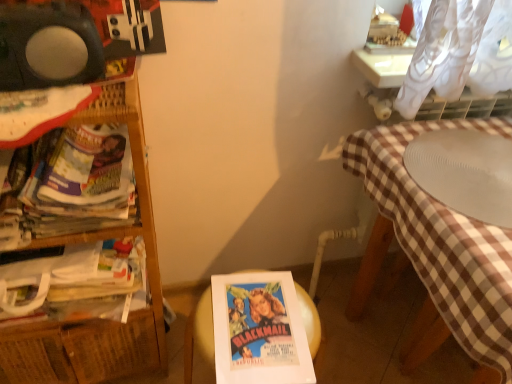
This screenshot has height=384, width=512. I want to click on free space above paperback book at left, which is the second book from top to bottom (from a real-world perspective), so click(103, 265).